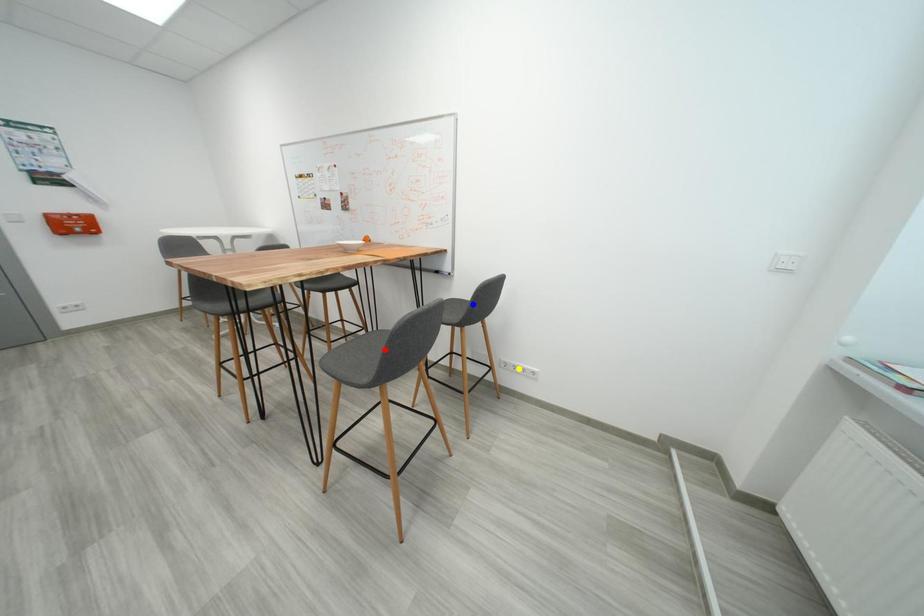
Consider the image. Order these from farthest to nearest:
red point
yellow point
blue point

yellow point → blue point → red point